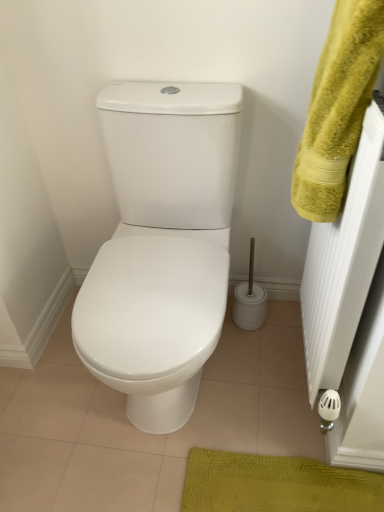
This screenshot has width=384, height=512. In order to click on yellow fluffy towel at upper right in this screenshot , I will do [x=337, y=106].

What is the approximate height of yellow fluffy towel at upper right?

It is 15.04 inches.

What do you see at coordinates (337, 106) in the screenshot? This screenshot has height=512, width=384. I see `yellow fluffy towel at upper right` at bounding box center [337, 106].

Describe the element at coordinates (162, 246) in the screenshot. I see `white glossy toilet at center` at that location.

Locate an element on the screen. white glossy toilet at center is located at coordinates (162, 246).

Where is `yellow fluffy towel at upper right`? Image resolution: width=384 pixels, height=512 pixels. yellow fluffy towel at upper right is located at coordinates (337, 106).

Is yellow fluffy towel at upper right to the left or to the right of white glossy toilet at center in the image?

yellow fluffy towel at upper right is to the right of white glossy toilet at center.

Considering the relative positions of yellow fluffy towel at upper right and white glossy toilet at center in the image provided, is yellow fluffy towel at upper right in front of white glossy toilet at center?

Yes, yellow fluffy towel at upper right is in front of white glossy toilet at center.

Between point (317, 144) and point (102, 322), which one is positioned behind?

The point (102, 322) is farther.

From the image's perspective, would you say yellow fluffy towel at upper right is shown under white glossy toilet at center?

No, from the image's perspective, yellow fluffy towel at upper right is not below white glossy toilet at center.

From a real-world perspective, is yellow fluffy towel at upper right above or below white glossy toilet at center?

From a real-world perspective, yellow fluffy towel at upper right is physically above white glossy toilet at center.

From the picture: Can you confirm if yellow fluffy towel at upper right is wider than white glossy toilet at center?

No, yellow fluffy towel at upper right is not wider than white glossy toilet at center.

Who is shorter, yellow fluffy towel at upper right or white glossy toilet at center?

Standing shorter between the two is yellow fluffy towel at upper right.

Who is bigger, yellow fluffy towel at upper right or white glossy toilet at center?

With larger size is white glossy toilet at center.

Does yellow fluffy towel at upper right contain white glossy toilet at center?

Actually, white glossy toilet at center is outside yellow fluffy towel at upper right.

Is yellow fluffy towel at upper right not near white glossy toilet at center?

No.

Is white glossy toilet at center at the back of yellow fluffy towel at upper right?

yellow fluffy towel at upper right does not have its back to white glossy toilet at center.

How different are the orientations of yellow fluffy towel at upper right and white glossy toilet at center in degrees?

The angle between the facing direction of yellow fluffy towel at upper right and the facing direction of white glossy toilet at center is 90.6 degrees.

In the image, there is a yellow fluffy towel at upper right. Identify the location of toilet below it (from a real-world perspective). (162, 246).

Is white glossy toilet at center at the left side of yellow fluffy towel at upper right?

Indeed, white glossy toilet at center is positioned on the left side of yellow fluffy towel at upper right.

Which object is further away from the camera taking this photo, white glossy toilet at center or yellow fluffy towel at upper right?

white glossy toilet at center.

Which is behind, point (195, 193) or point (350, 66)?

The point (195, 193) is behind.

From the image's perspective, is white glossy toilet at center located beneath yellow fluffy towel at upper right?

Indeed, from the image's perspective, white glossy toilet at center is shown beneath yellow fluffy towel at upper right.

From a real-world perspective, is white glossy toilet at center on yellow fluffy towel at upper right?

Actually, white glossy toilet at center is physically below yellow fluffy towel at upper right in the real world.

Which object is thinner, white glossy toilet at center or yellow fluffy towel at upper right?

Thinner between the two is yellow fluffy towel at upper right.

Considering the sizes of objects white glossy toilet at center and yellow fluffy towel at upper right in the image provided, who is shorter, white glossy toilet at center or yellow fluffy towel at upper right?

yellow fluffy towel at upper right.

Can you confirm if white glossy toilet at center is bigger than yellow fluffy towel at upper right?

Yes, white glossy toilet at center is bigger than yellow fluffy towel at upper right.

Would you say white glossy toilet at center is outside yellow fluffy towel at upper right?

Yes, white glossy toilet at center is located beyond the bounds of yellow fluffy towel at upper right.

Is white glossy toilet at center with yellow fluffy towel at upper right?

No, white glossy toilet at center is not touching yellow fluffy towel at upper right.

Could you tell me if white glossy toilet at center is facing yellow fluffy towel at upper right?

No, white glossy toilet at center is not facing towards yellow fluffy towel at upper right.

The width and height of the screenshot is (384, 512). Find the location of `bath towel above the white glossy toilet at center (from the image's perspective)`. bath towel above the white glossy toilet at center (from the image's perspective) is located at coordinates (337, 106).

This screenshot has height=512, width=384. What are the coordinates of `bath towel in front of the white glossy toilet at center` in the screenshot? It's located at (337, 106).

Find the location of a particular element. The image size is (384, 512). toilet on the left of yellow fluffy towel at upper right is located at coordinates (162, 246).